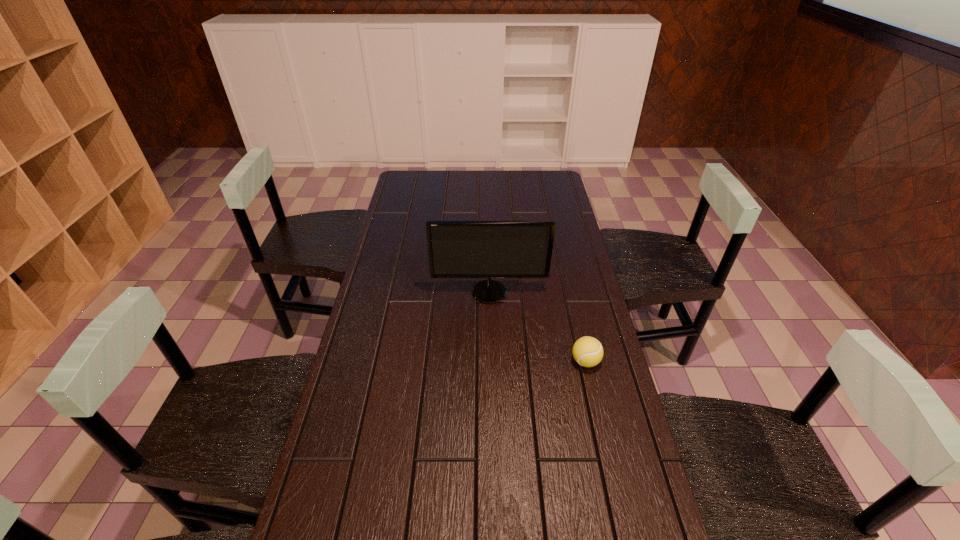
Locate an element on the screen. The image size is (960, 540). free location that satisfies the following two spatial constraints: 1. on the front-facing side of the computer monitor; 2. on the right side of the shorter object is located at coordinates (491, 361).